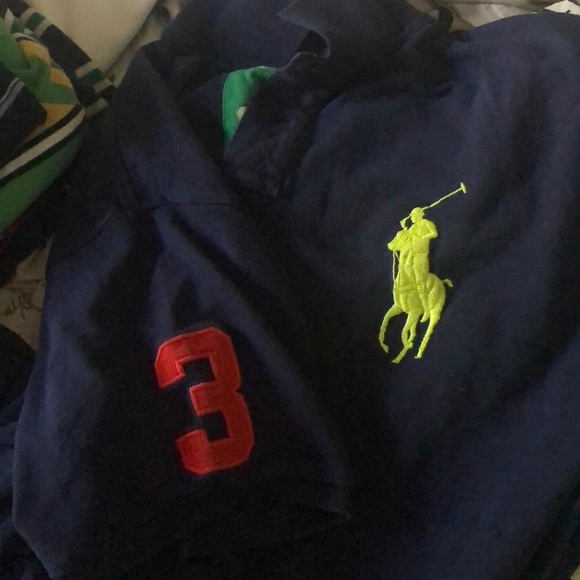
Where is `folded shirts`? Image resolution: width=580 pixels, height=580 pixels. folded shirts is located at coordinates (19, 111), (57, 118), (87, 68).